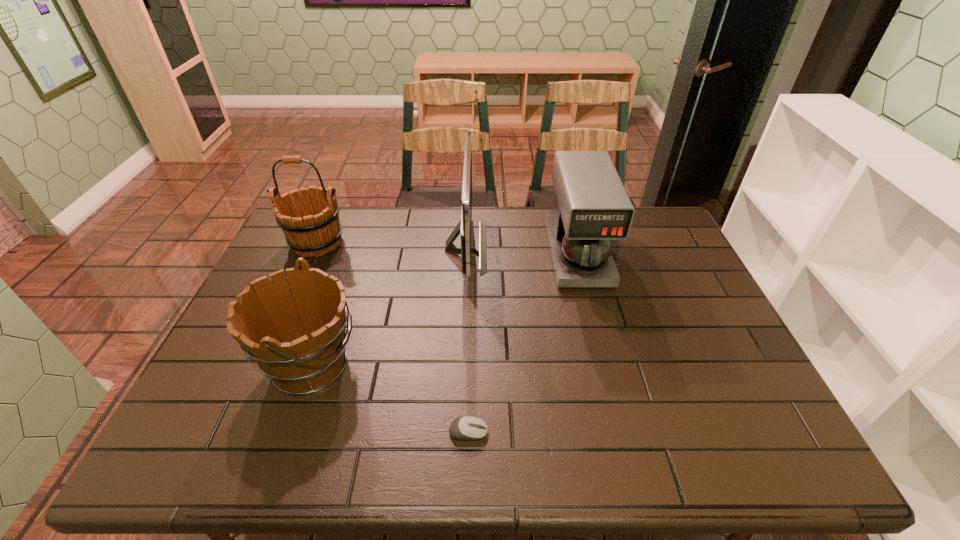
In the image, there is a desktop. Where is `vacant space at the right edge`? Image resolution: width=960 pixels, height=540 pixels. vacant space at the right edge is located at coordinates (697, 394).

In the image, there is a desktop. Identify the location of free space at the near left corner. (210, 439).

I want to click on free point at the far right corner, so click(x=654, y=215).

Identify the location of vacant area between the farther wine bucket and the monitor. This screenshot has width=960, height=540. (392, 245).

The width and height of the screenshot is (960, 540). Find the location of `empty location between the taller wine bucket and the shortest object`. empty location between the taller wine bucket and the shortest object is located at coordinates (393, 338).

The width and height of the screenshot is (960, 540). Identify the location of vacant area that lies between the farther wine bucket and the nearest object. (393, 338).

Identify the location of free point between the shortest object and the monitor. (468, 340).

This screenshot has width=960, height=540. I want to click on vacant space in between the rightmost object and the monitor, so click(x=522, y=251).

Locate an element on the screen. free spot between the rightmost object and the nearest object is located at coordinates (523, 343).

Image resolution: width=960 pixels, height=540 pixels. Identify the location of vacant space that is in between the shorter wine bucket and the monitor. (389, 306).